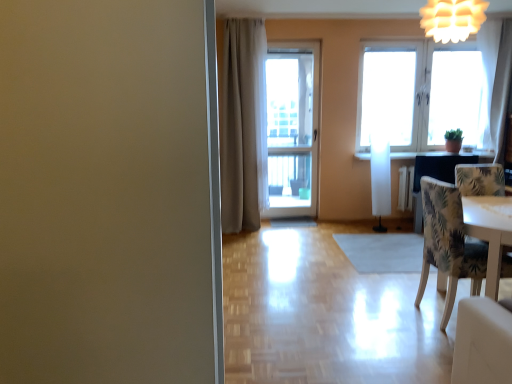
Question: Is white sheer curtain at upper right, the 1th curtain in the right-to-left sequence, facing away from white paper lantern at upper right?

Choices:
 (A) no
 (B) yes

Answer: (A)

Question: Is white sheer curtain at upper right, the 1th curtain in the right-to-left sequence, aimed at white paper lantern at upper right?

Choices:
 (A) no
 (B) yes

Answer: (A)

Question: From a real-world perspective, is white sheer curtain at upper right, which ranks as the 2th curtain in left-to-right order, positioned under white paper lantern at upper right based on gravity?

Choices:
 (A) no
 (B) yes

Answer: (B)

Question: Does white sheer curtain at upper right, the 1th curtain in the right-to-left sequence, have a lesser height compared to white paper lantern at upper right?

Choices:
 (A) yes
 (B) no

Answer: (B)

Question: Considering the relative sizes of white sheer curtain at upper right, which ranks as the 2th curtain in left-to-right order, and white paper lantern at upper right in the image provided, is white sheer curtain at upper right, which ranks as the 2th curtain in left-to-right order, bigger than white paper lantern at upper right?

Choices:
 (A) no
 (B) yes

Answer: (B)

Question: Is point (245, 211) positioned closer to the camera than point (448, 188)?

Choices:
 (A) closer
 (B) farther

Answer: (B)

Question: From a real-world perspective, is beige fabric curtain at center, arranged as the first curtain when viewed from the left, above or below patterned fabric chair at right?

Choices:
 (A) below
 (B) above

Answer: (B)

Question: Is beige fabric curtain at center, arranged as the first curtain when viewed from the left, bigger or smaller than patterned fabric chair at right?

Choices:
 (A) big
 (B) small

Answer: (A)

Question: In the image, is beige fabric curtain at center, placed as the second curtain when sorted from right to left, on the left side or the right side of patterned fabric chair at right?

Choices:
 (A) right
 (B) left

Answer: (B)

Question: Is white glass door at center situated inside patterned fabric chair at right or outside?

Choices:
 (A) inside
 (B) outside

Answer: (B)

Question: From a real-world perspective, is white glass door at center above or below patterned fabric chair at right?

Choices:
 (A) below
 (B) above

Answer: (B)

Question: Is white glass door at center in front of or behind patterned fabric chair at right in the image?

Choices:
 (A) behind
 (B) front

Answer: (A)

Question: In terms of height, does white glass door at center look taller or shorter compared to patterned fabric chair at right?

Choices:
 (A) short
 (B) tall

Answer: (B)

Question: Is point (487, 125) positioned closer to the camera than point (453, 105)?

Choices:
 (A) farther
 (B) closer

Answer: (B)

Question: From the image's perspective, is white sheer curtain at upper right, the 1th curtain in the right-to-left sequence, above or below white glass window at upper right?

Choices:
 (A) below
 (B) above

Answer: (A)